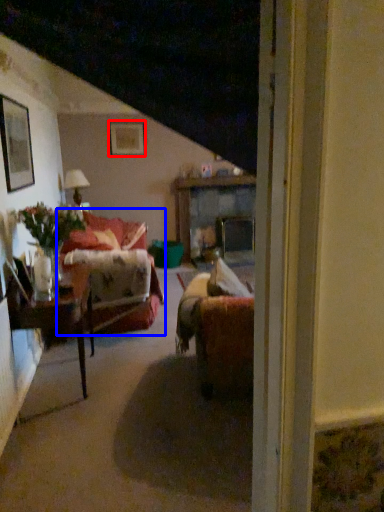
Question: Which object is closer to the camera taking this photo, picture frame (highlighted by a red box) or studio couch (highlighted by a blue box)?

Choices:
 (A) picture frame
 (B) studio couch

Answer: (B)